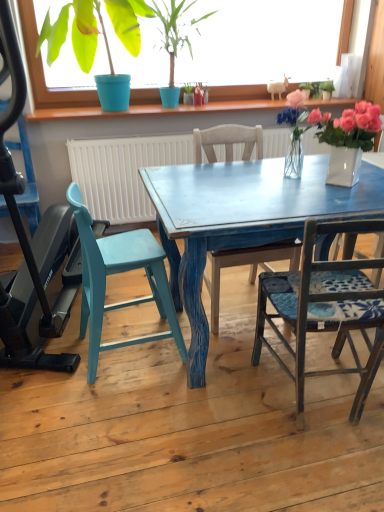
Question: From the image's perspective, would you say wooden chair at center, which is the second chair in left-to-right order, is positioned over green matte plant at upper center, the 2th houseplant when ordered from left to right?

Choices:
 (A) no
 (B) yes

Answer: (A)

Question: Would you say green matte plant at upper center, the 2th houseplant when ordered from left to right, is part of wooden chair at center, which is the second chair in left-to-right order,'s contents?

Choices:
 (A) no
 (B) yes

Answer: (A)

Question: Can you confirm if wooden chair at center, which is the second chair in left-to-right order, is taller than green matte plant at upper center, the 1th houseplant viewed from the right?

Choices:
 (A) no
 (B) yes

Answer: (B)

Question: Does wooden chair at center, which is the second chair in left-to-right order, appear on the left side of green matte plant at upper center, the 2th houseplant when ordered from left to right?

Choices:
 (A) no
 (B) yes

Answer: (A)

Question: From a real-world perspective, is wooden chair at center, which is counted as the 2th chair, starting from the right, on top of green matte plant at upper center, the 2th houseplant when ordered from left to right?

Choices:
 (A) no
 (B) yes

Answer: (A)

Question: Is wooden chair at center, which is the second chair in left-to-right order, wider than green matte plant at upper center, the 2th houseplant when ordered from left to right?

Choices:
 (A) yes
 (B) no

Answer: (A)

Question: Does green matte plant at upper left, the 1th houseplant from the left, have a larger size compared to wooden chair at center, which is the second chair in left-to-right order?

Choices:
 (A) yes
 (B) no

Answer: (B)

Question: Is green matte plant at upper left, which is counted as the second houseplant, starting from the right, looking in the opposite direction of wooden chair at center, which is counted as the 2th chair, starting from the right?

Choices:
 (A) no
 (B) yes

Answer: (A)

Question: Is green matte plant at upper left, which is counted as the second houseplant, starting from the right, far from wooden chair at center, which is the second chair in left-to-right order?

Choices:
 (A) yes
 (B) no

Answer: (A)

Question: Considering the relative sizes of green matte plant at upper left, the 1th houseplant from the left, and wooden chair at center, which is the second chair in left-to-right order, in the image provided, is green matte plant at upper left, the 1th houseplant from the left, taller than wooden chair at center, which is the second chair in left-to-right order,?

Choices:
 (A) yes
 (B) no

Answer: (B)

Question: Is green matte plant at upper left, which is counted as the second houseplant, starting from the right, in front of wooden chair at center, which is counted as the 2th chair, starting from the right?

Choices:
 (A) yes
 (B) no

Answer: (B)

Question: Is green matte plant at upper left, which is counted as the second houseplant, starting from the right, behind wooden chair at center, which is counted as the 2th chair, starting from the right?

Choices:
 (A) yes
 (B) no

Answer: (A)

Question: Would you consider green matte plant at upper left, which is counted as the second houseplant, starting from the right, to be distant from translucent glass vase at center?

Choices:
 (A) yes
 (B) no

Answer: (A)